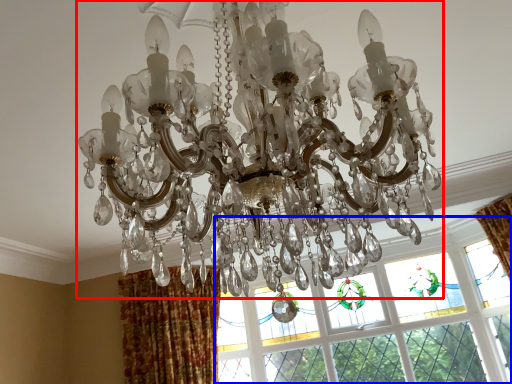
Question: Which of the following is the closest to the observer, lamp (highlighted by a red box) or window (highlighted by a blue box)?

Choices:
 (A) lamp
 (B) window

Answer: (A)